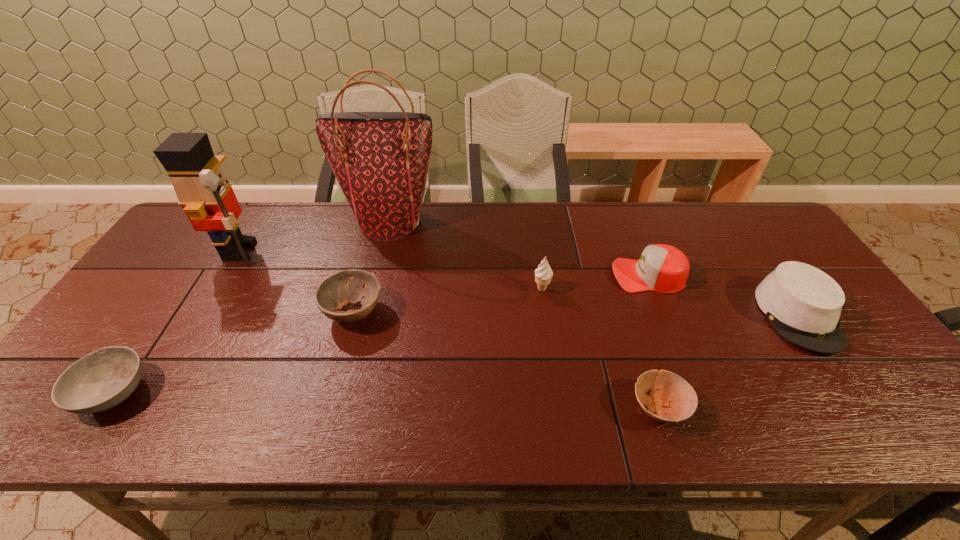
The image size is (960, 540). I want to click on handbag present at the far edge, so click(x=380, y=160).

Where is `nutcracker positioned at the far edge`? The width and height of the screenshot is (960, 540). nutcracker positioned at the far edge is located at coordinates (x=204, y=192).

Where is `nutcracker that is at the left edge`? The height and width of the screenshot is (540, 960). nutcracker that is at the left edge is located at coordinates (204, 192).

Identify the location of bowl situated at the left edge. (104, 378).

The height and width of the screenshot is (540, 960). In order to click on object that is positioned at the right edge in this screenshot , I will do `click(803, 304)`.

You are a GUI agent. You are given a task and a screenshot of the screen. Output one action in this format:
    pyautogui.click(x=<x>, y=<y>)
    Task: Click on the object present at the far left corner
    This screenshot has width=960, height=540.
    Given the screenshot: What is the action you would take?
    pyautogui.click(x=204, y=192)

This screenshot has width=960, height=540. Find the location of `object at the near left corner`. object at the near left corner is located at coordinates (104, 378).

In order to click on vacant area at the far edge of the desktop in this screenshot , I will do `click(307, 245)`.

Find the location of a particular element. This screenshot has width=960, height=540. free space at the near edge of the desktop is located at coordinates (287, 436).

You are a GUI agent. You are given a task and a screenshot of the screen. Output one action in this format:
    pyautogui.click(x=<x>, y=<y>)
    Task: Click on the free space at the left edge
    
    Given the screenshot: What is the action you would take?
    pyautogui.click(x=154, y=314)